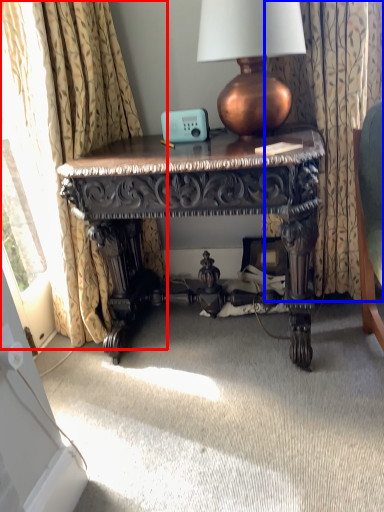
Question: Among these objects, which one is farthest to the camera, curtain (highlighted by a red box) or curtain (highlighted by a blue box)?

Choices:
 (A) curtain
 (B) curtain

Answer: (B)